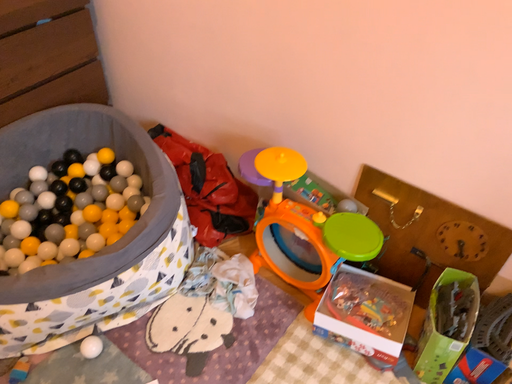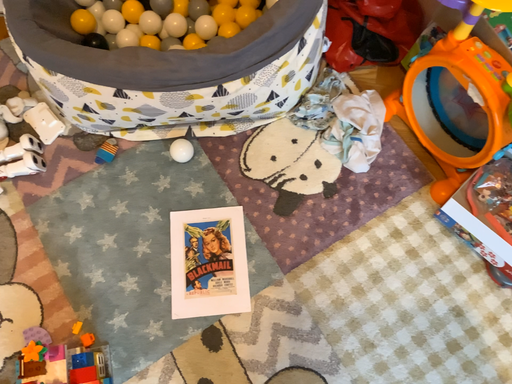
Question: Which way did the camera rotate in the video?

Choices:
 (A) rotated downward
 (B) rotated upward

Answer: (A)